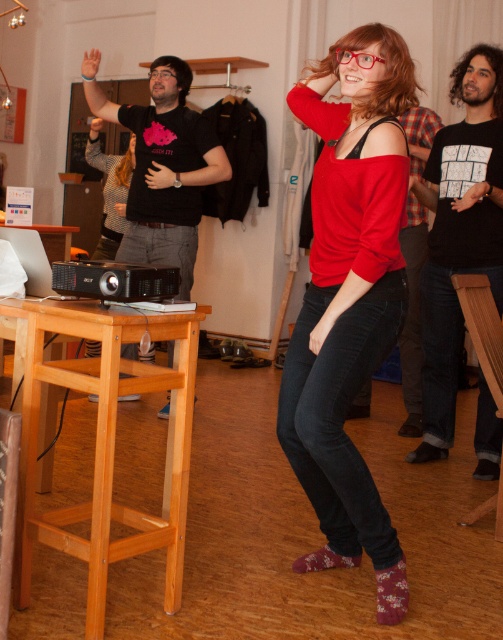
You are standing in the center of the room and want to reach the matte red sweater at center. Which direction should you move to get there?

The matte red sweater at center is already at the center of the room, so you don not need to move in any direction to reach it.

You are at a party and want to place a small plant on the matte red sweater at center so it can be seen by guests sitting on the light brown wooden bar stool at lower left. Will the plant be visible from there?

The matte red sweater at center is taller than the light brown wooden bar stool at lower left, so yes, the plant placed on the matte red sweater at center will be visible to guests sitting on the light brown wooden bar stool at lower left.